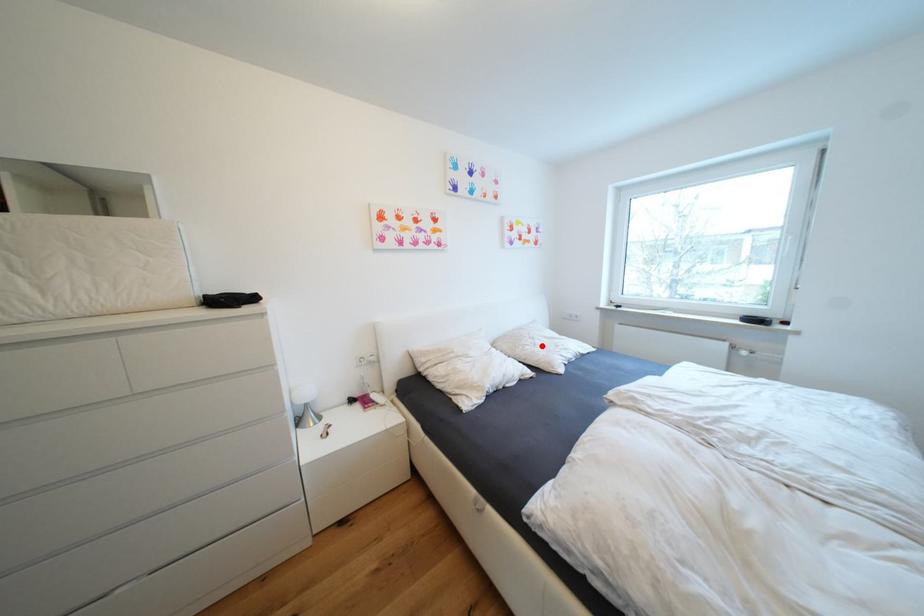
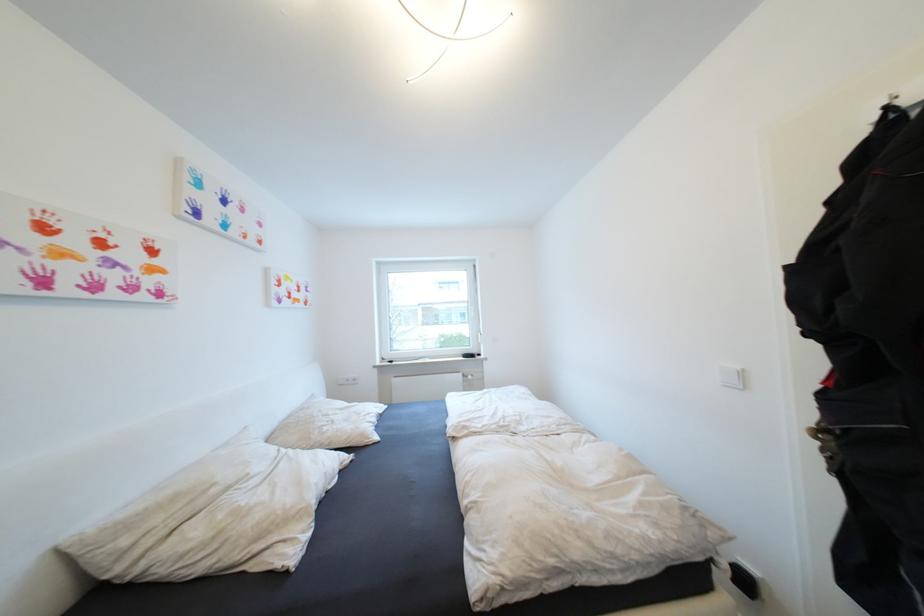
Find the pixel in the second image that matches the highlighted location in the first image.

(339, 423)